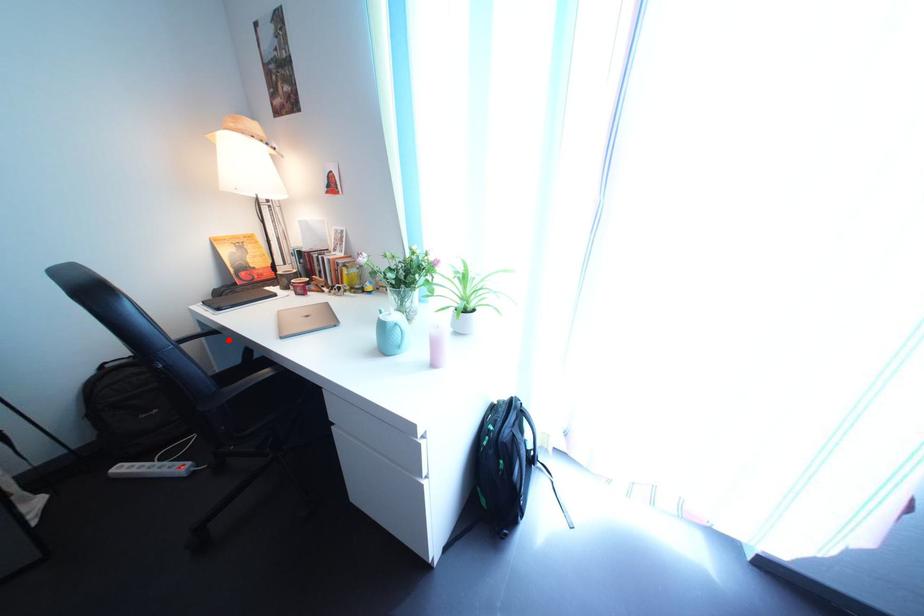
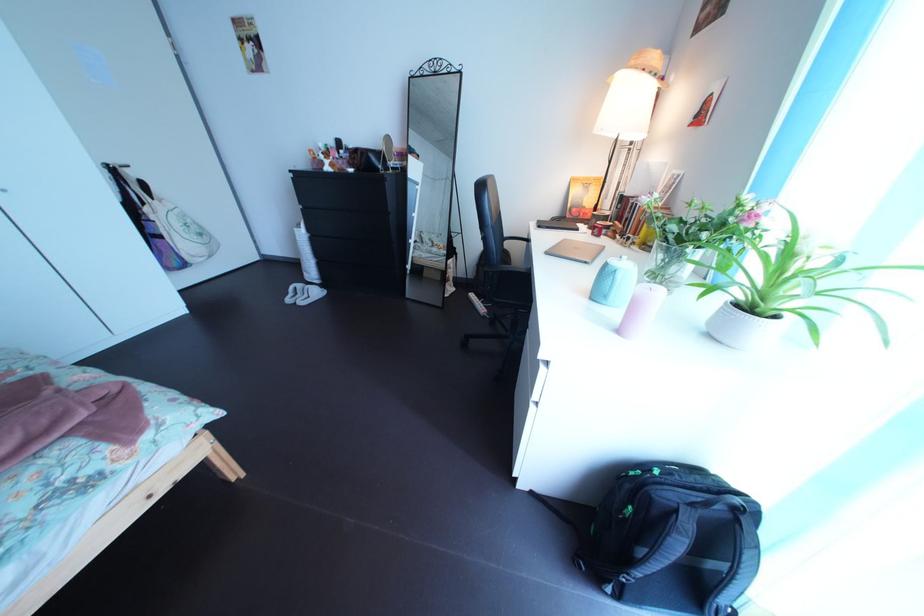
Question: I am providing you with two images of the same scene from different viewpoints. In image1, a red point is highlighted. Considering the same 3D point in image2, which of the following is correct?

Choices:
 (A) It is closer
 (B) It is farther

Answer: (A)